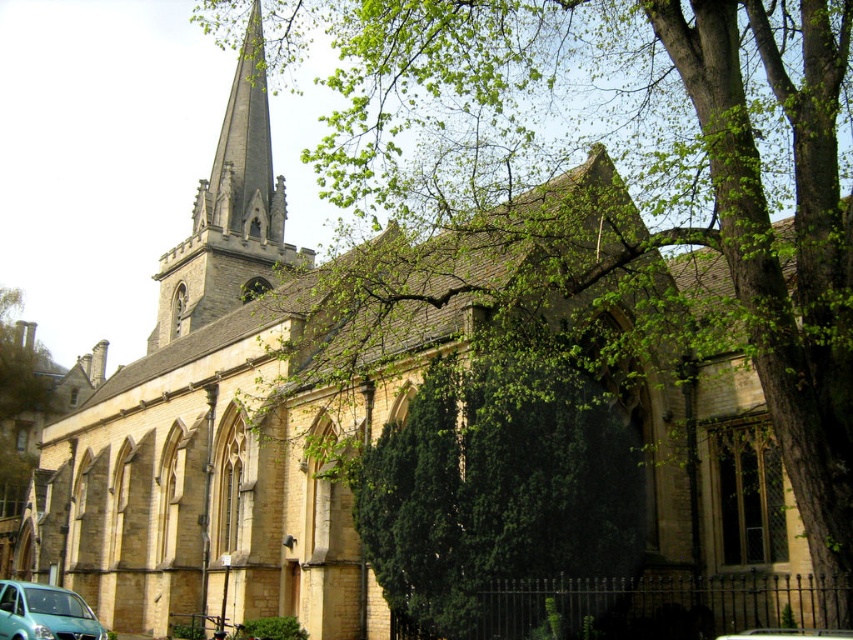
Is point (262, 52) behind point (38, 584)?

That is True.

Is smooth gray stone spire at upper center bigger than teal matte van at lower left?

Indeed, smooth gray stone spire at upper center has a larger size compared to teal matte van at lower left.

Where is `smooth gray stone spire at upper center`? The image size is (853, 640). smooth gray stone spire at upper center is located at coordinates (247, 150).

Is dark gray stone steeple at upper left taller than teal matte van at lower left?

Yes, dark gray stone steeple at upper left is taller than teal matte van at lower left.

What do you see at coordinates (230, 212) in the screenshot? This screenshot has height=640, width=853. I see `dark gray stone steeple at upper left` at bounding box center [230, 212].

Between point (254, 289) and point (62, 595), which one is positioned in front?

Point (62, 595) is more forward.

I want to click on dark gray stone steeple at upper left, so click(x=230, y=212).

Can you confirm if dark gray stone steeple at upper left is positioned above smooth gray stone spire at upper center?

No, dark gray stone steeple at upper left is not above smooth gray stone spire at upper center.

Consider the image. Who is shorter, dark gray stone steeple at upper left or smooth gray stone spire at upper center?

Standing shorter between the two is smooth gray stone spire at upper center.

Who is more distant from viewer, (x=270, y=260) or (x=260, y=116)?

Point (x=260, y=116)

This screenshot has width=853, height=640. Find the location of `dark gray stone steeple at upper left`. dark gray stone steeple at upper left is located at coordinates (230, 212).